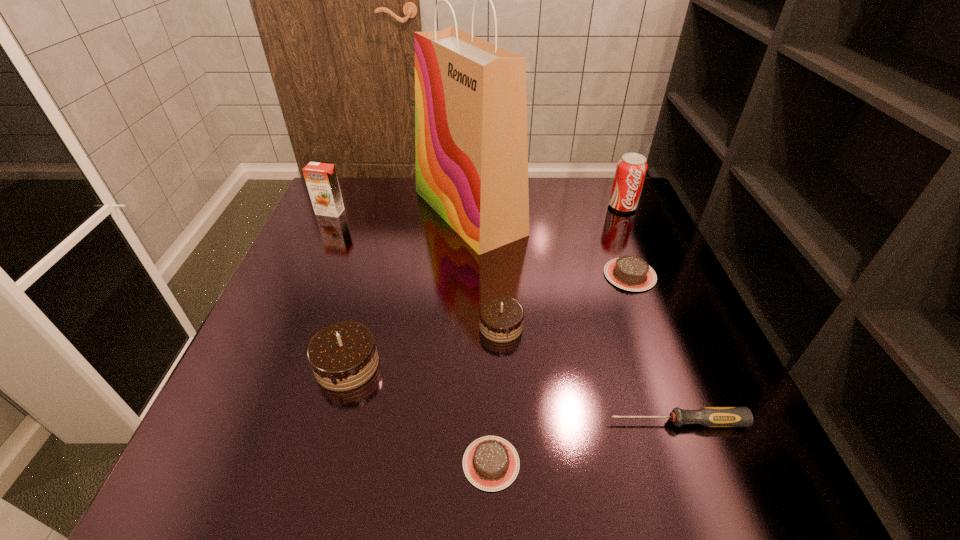
You are a GUI agent. You are given a task and a screenshot of the screen. Output one action in this format:
    pyautogui.click(x=<x>, y=<y>)
    Task: Click on the vacant region located insert the screwdriver into a screw head
    This screenshot has height=540, width=960.
    Given the screenshot: What is the action you would take?
    pyautogui.click(x=486, y=422)

Find the location of a particular element. free space located on the back of the rightmost chocolate cake is located at coordinates (605, 208).

Where is `free location located on the left of the shortest object`? This screenshot has height=540, width=960. free location located on the left of the shortest object is located at coordinates 343,463.

I want to click on shopping bag situated at the far edge, so click(471, 149).

Where is `soda can at the far edge`? soda can at the far edge is located at coordinates (631, 169).

This screenshot has height=540, width=960. In order to click on orange juice present at the far edge in this screenshot , I will do `click(321, 179)`.

Locate an element on the screen. object at the near edge is located at coordinates (491, 463).

At what (x,y) coordinates should I click in order to perform the action: click on orange juice present at the left edge. Please return your answer as a coordinate pair (x, y). Image resolution: width=960 pixels, height=540 pixels. Looking at the image, I should click on (321, 179).

At what (x,y) coordinates should I click in order to perform the action: click on chocolate cake at the left edge. Please return your answer as a coordinate pair (x, y). The height and width of the screenshot is (540, 960). Looking at the image, I should click on (343, 356).

At what (x,y) coordinates should I click in order to perform the action: click on soda can situated at the right edge. Please return your answer as a coordinate pair (x, y). Looking at the image, I should click on (631, 169).